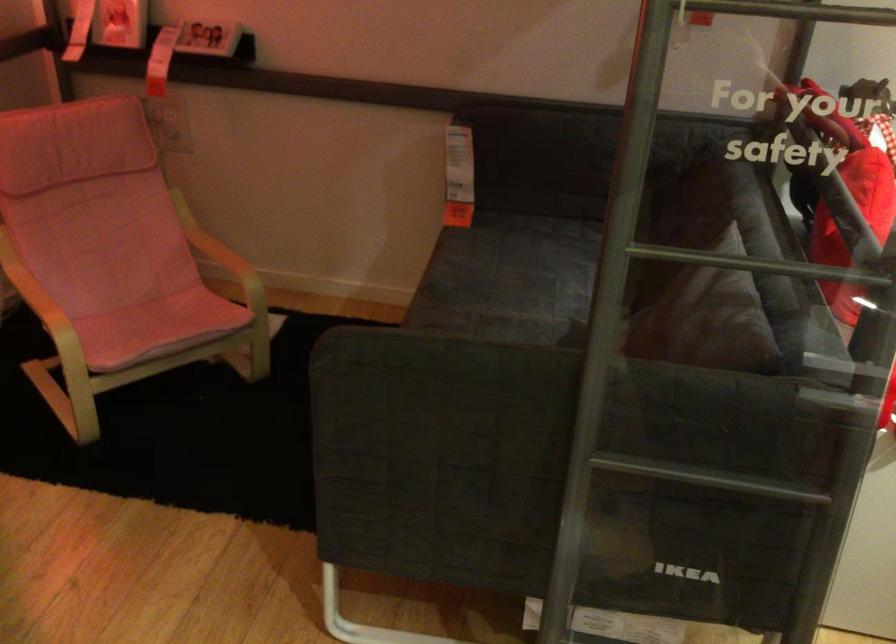
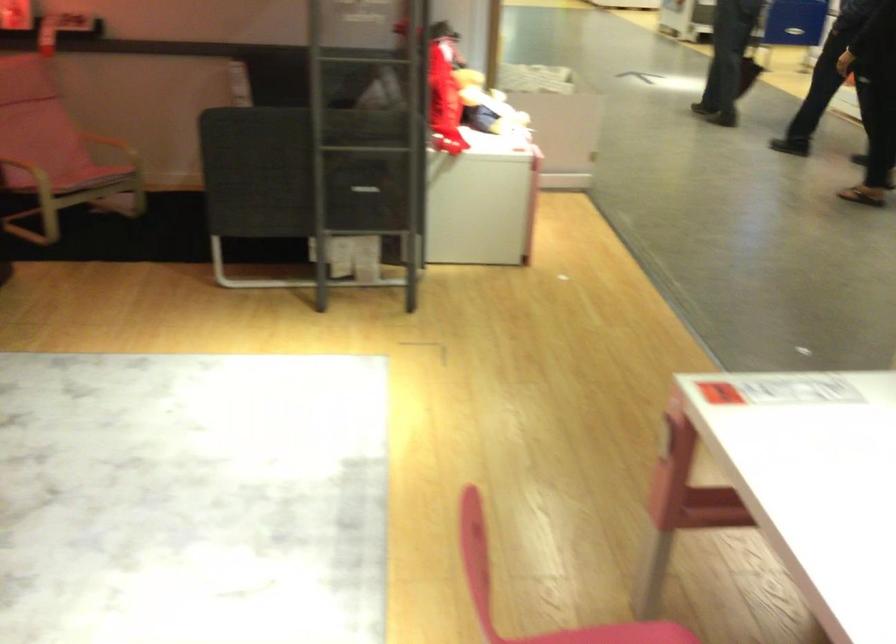
Question: What movement of the cameraman would produce the second image?

Choices:
 (A) Left
 (B) Right
 (C) Forward
 (D) Backward

Answer: (D)